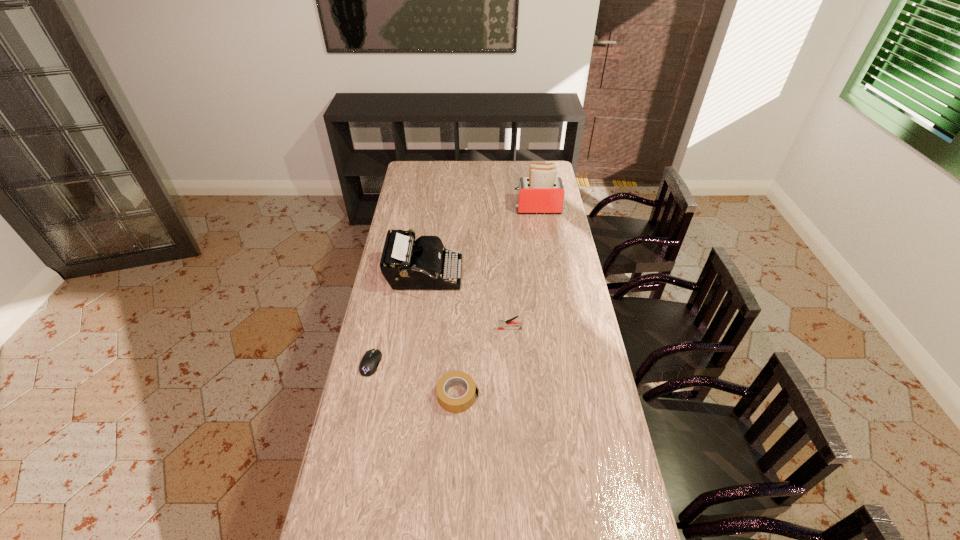
Locate an element on the screen. Image resolution: width=960 pixels, height=540 pixels. vacant point located between the nearest object and the fourth nearest object is located at coordinates (442, 335).

Identify which object is the third nearest to the fourth farthest object. Please provide its 2D coordinates. Your answer should be formatted as a tuple, i.e. [(x, y)], where the tuple contains the x and y coordinates of a point satisfying the conditions above.

[(501, 326)]

Select which object is the fourth closest to the second shortest object. Please provide its 2D coordinates. Your answer should be formatted as a tuple, i.e. [(x, y)], where the tuple contains the x and y coordinates of a point satisfying the conditions above.

[(542, 192)]

Locate an element on the screen. The width and height of the screenshot is (960, 540). vacant space that satisfies the following two spatial constraints: 1. on the typing side of the typewriter; 2. on the front side of the computer equipment is located at coordinates (413, 363).